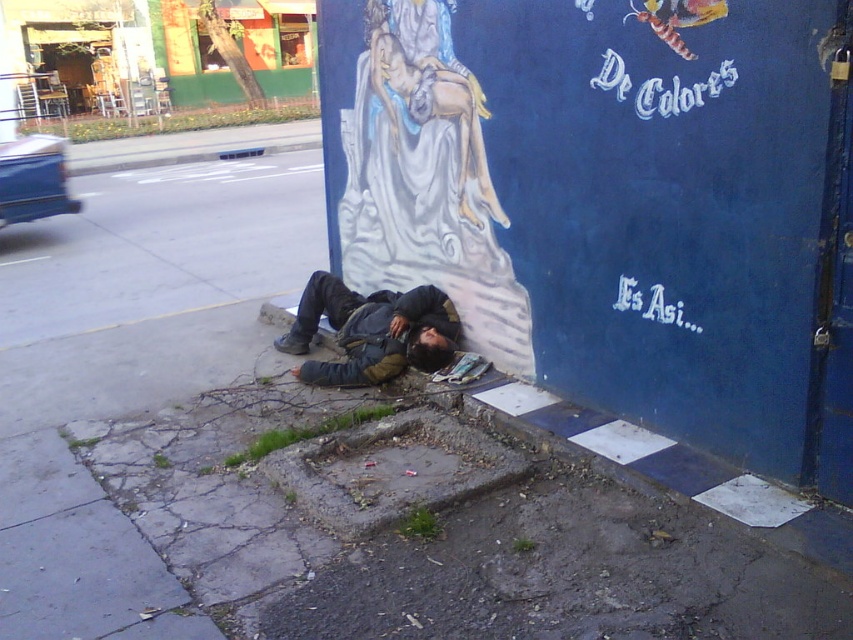
Question: Which object is farther from the camera taking this photo?

Choices:
 (A) dark gray jacket at lower center
 (B) smooth concrete curb at lower center

Answer: (A)

Question: From the image, what is the correct spatial relationship of smooth concrete curb at lower center in relation to dark gray jacket at lower center?

Choices:
 (A) left
 (B) right

Answer: (B)

Question: Is smooth concrete curb at lower center below dark gray jacket at lower center?

Choices:
 (A) yes
 (B) no

Answer: (A)

Question: Which object is farther from the camera taking this photo?

Choices:
 (A) smooth concrete curb at lower center
 (B) dark gray jacket at lower center

Answer: (B)

Question: Is smooth concrete curb at lower center smaller than dark gray jacket at lower center?

Choices:
 (A) yes
 (B) no

Answer: (B)